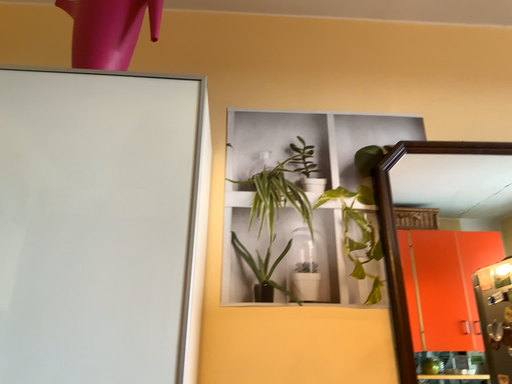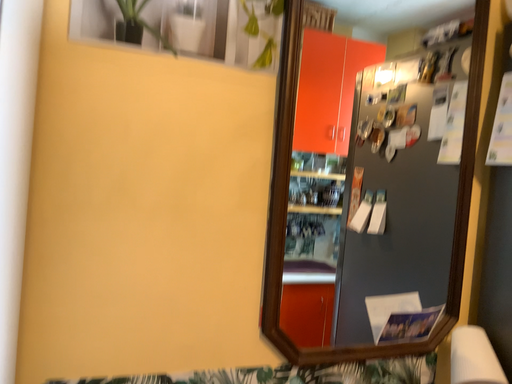
Question: How did the camera likely rotate when shooting the video?

Choices:
 (A) rotated upward
 (B) rotated downward

Answer: (B)